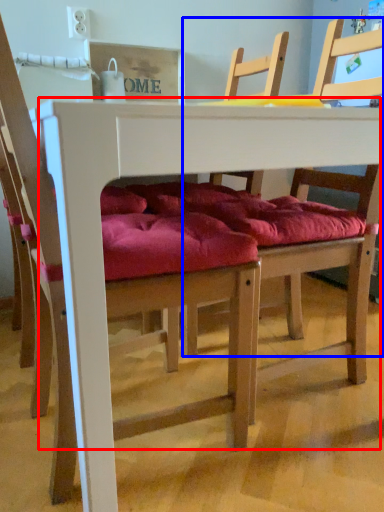
Question: Which of the following is the closest to the observer, table (highlighted by a red box) or chair (highlighted by a blue box)?

Choices:
 (A) table
 (B) chair

Answer: (A)